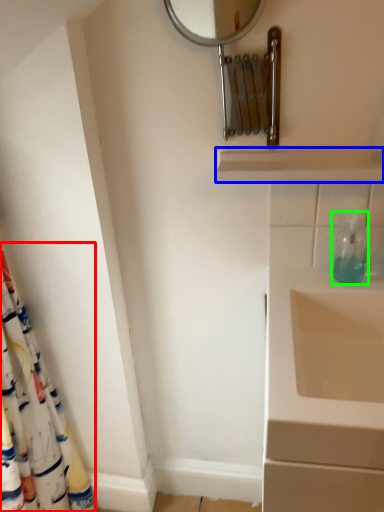
Question: Based on their relative distances, which object is farther from shower curtain (highlighted by a red box)? Choose from balustrade (highlighted by a blue box) and soap dispenser (highlighted by a green box).

Choices:
 (A) balustrade
 (B) soap dispenser

Answer: (B)